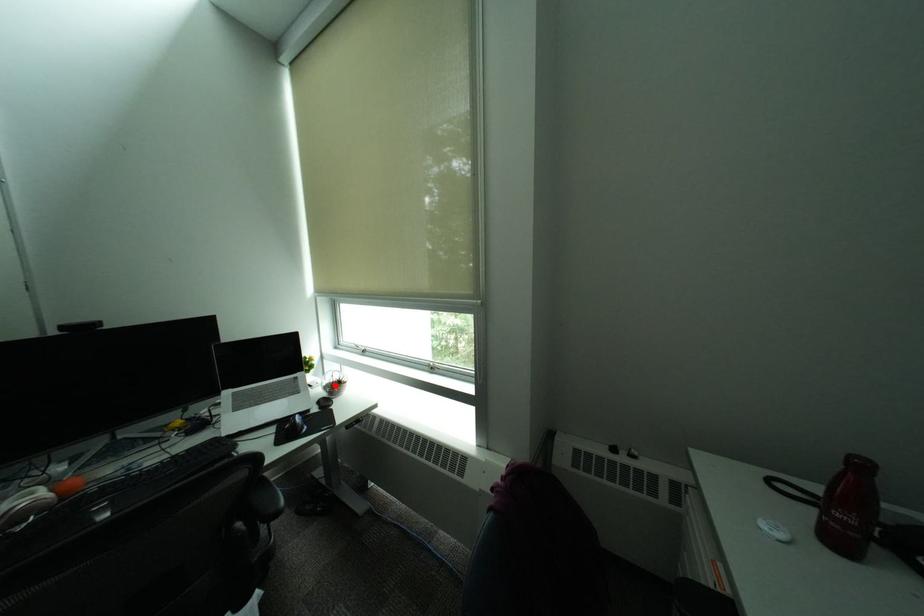
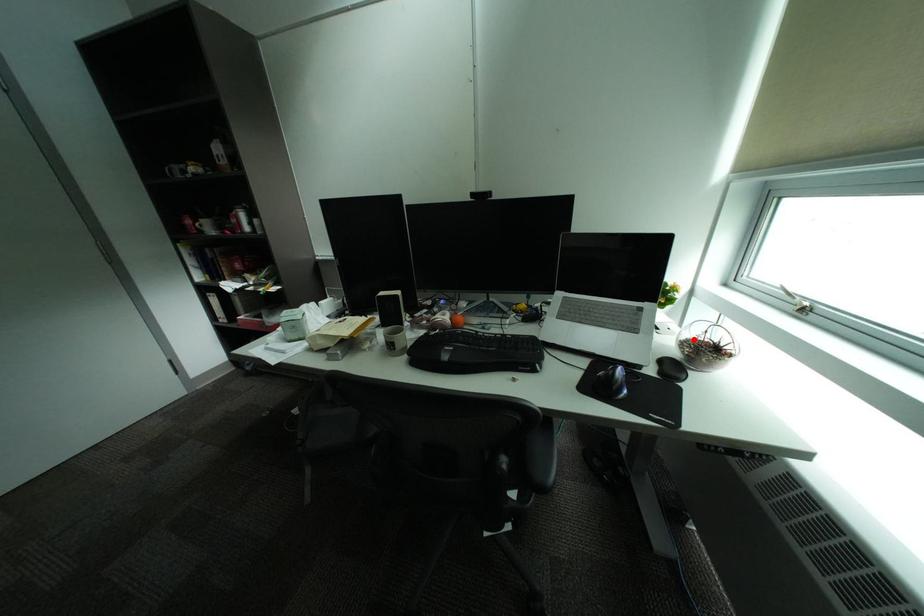
I am providing you with two images of the same scene from different viewpoints. A red point is marked on the first image and another point is marked on the second image. Are the points marked in image1 and image2 representing the same 3D position?

Yes